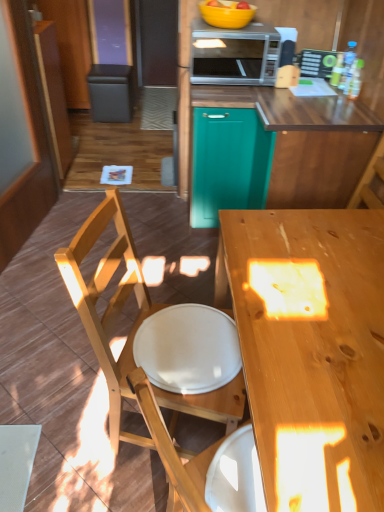
Question: Is teal matte cabinet at center to the left of silver metallic microwave at upper center from the viewer's perspective?

Choices:
 (A) no
 (B) yes

Answer: (B)

Question: Is teal matte cabinet at center positioned in front of silver metallic microwave at upper center?

Choices:
 (A) no
 (B) yes

Answer: (A)

Question: From a real-world perspective, is teal matte cabinet at center physically below silver metallic microwave at upper center?

Choices:
 (A) no
 (B) yes

Answer: (B)

Question: Considering the relative sizes of teal matte cabinet at center and silver metallic microwave at upper center in the image provided, is teal matte cabinet at center thinner than silver metallic microwave at upper center?

Choices:
 (A) no
 (B) yes

Answer: (A)

Question: From the image's perspective, is teal matte cabinet at center beneath silver metallic microwave at upper center?

Choices:
 (A) no
 (B) yes

Answer: (B)

Question: From a real-world perspective, is yellow matte bowl at upper center physically located above or below green plastic sign at upper right?

Choices:
 (A) above
 (B) below

Answer: (A)

Question: Considering their positions, is yellow matte bowl at upper center located in front of or behind green plastic sign at upper right?

Choices:
 (A) front
 (B) behind

Answer: (A)

Question: In terms of height, does yellow matte bowl at upper center look taller or shorter compared to green plastic sign at upper right?

Choices:
 (A) short
 (B) tall

Answer: (A)

Question: Would you say yellow matte bowl at upper center is inside or outside green plastic sign at upper right?

Choices:
 (A) inside
 (B) outside

Answer: (B)

Question: Choose the correct answer: Is wooden chair at left inside wooden desk at center or outside it?

Choices:
 (A) inside
 (B) outside

Answer: (B)

Question: Is point (236, 400) closer or farther from the camera than point (322, 316)?

Choices:
 (A) closer
 (B) farther

Answer: (B)

Question: In terms of width, does wooden chair at left look wider or thinner when compared to wooden desk at center?

Choices:
 (A) thin
 (B) wide

Answer: (A)

Question: From a real-world perspective, relative to wooden desk at center, is wooden chair at left vertically above or below?

Choices:
 (A) below
 (B) above

Answer: (B)

Question: Considering their positions, is silver metallic microwave at upper center located in front of or behind green plastic sign at upper right?

Choices:
 (A) behind
 (B) front

Answer: (B)

Question: From a real-world perspective, is silver metallic microwave at upper center above or below green plastic sign at upper right?

Choices:
 (A) below
 (B) above

Answer: (B)